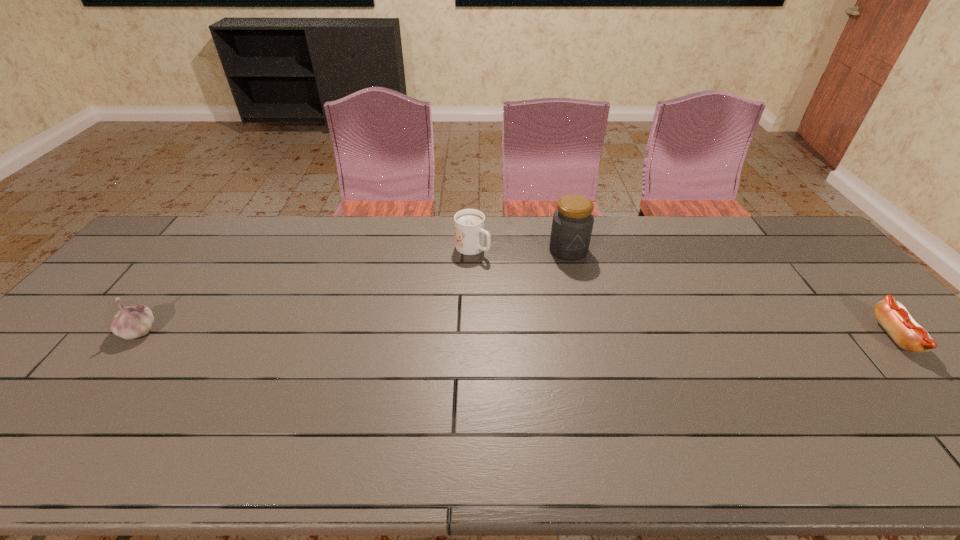
I want to click on the leftmost object, so click(136, 320).

I want to click on the rightmost object, so click(x=894, y=318).

The height and width of the screenshot is (540, 960). Find the location of `the shortest object`. the shortest object is located at coordinates (894, 318).

At what (x,y) coordinates should I click in order to perform the action: click on jar. Please return your answer as a coordinate pair (x, y). This screenshot has height=540, width=960. Looking at the image, I should click on (572, 224).

The width and height of the screenshot is (960, 540). In order to click on the second object from right to left in this screenshot , I will do `click(572, 224)`.

Find the location of a particular element. The image size is (960, 540). the second object from left to right is located at coordinates (469, 224).

Locate an element on the screen. Image resolution: width=960 pixels, height=540 pixels. vacant space located 0.100m on the left of the garlic is located at coordinates (84, 330).

The width and height of the screenshot is (960, 540). I want to click on free space located on the back of the shortest object, so pos(826,262).

Find the location of a particular element. The image size is (960, 540). vacant space located on the surface of the jar near the warning symbol is located at coordinates (580, 287).

Find the location of a particular element. The image size is (960, 540). free space located 0.140m on the surface of the jar near the warning symbol is located at coordinates (582, 292).